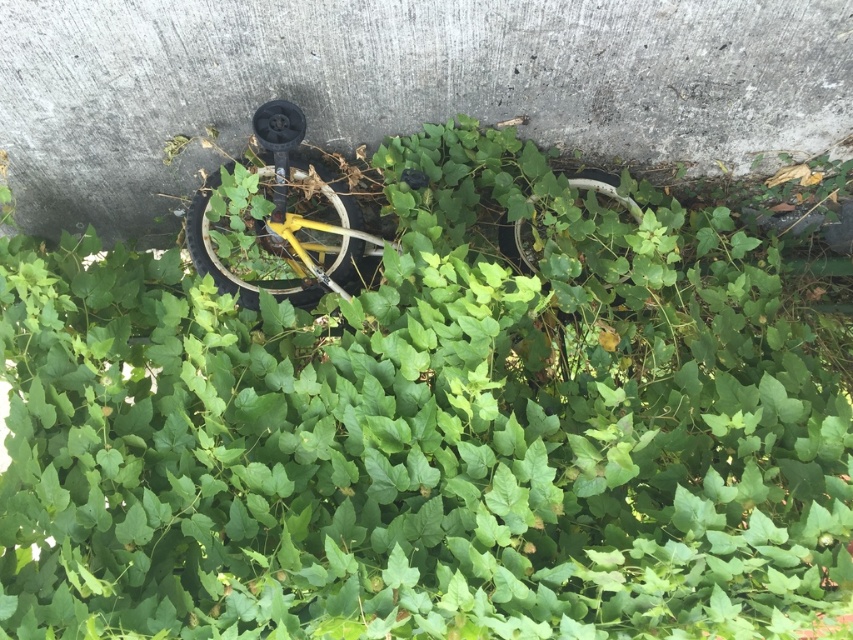
You are standing in a forest with dense green foliage and see two points marked in the scene. The first point is at coordinates point (183, 100) and the second point is at point (252, 285). Which point is closer to you?

Point (183, 100) is closer to you than point (252, 285) because it is further to the viewer.

You are a hiker who has stumbled upon this overgrown area. You notice the gray concrete at center and the yellow matte bicycle wheel at center. Which object is positioned higher in the scene?

The gray concrete at center is located above the yellow matte bicycle wheel at center, so it is positioned higher in the scene.